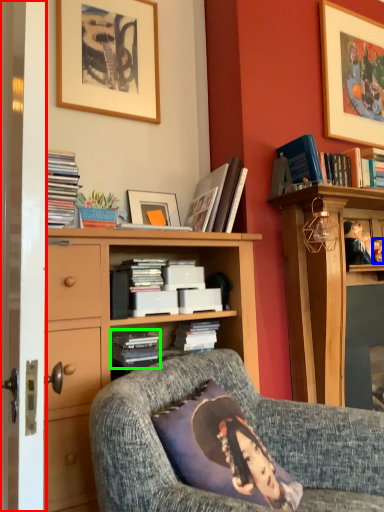
Question: Estimate the real-world distances between objects in this image. Which object is closer to screen door (highlighted by a red box), person (highlighted by a blue box) or book (highlighted by a green box)?

Choices:
 (A) person
 (B) book

Answer: (B)